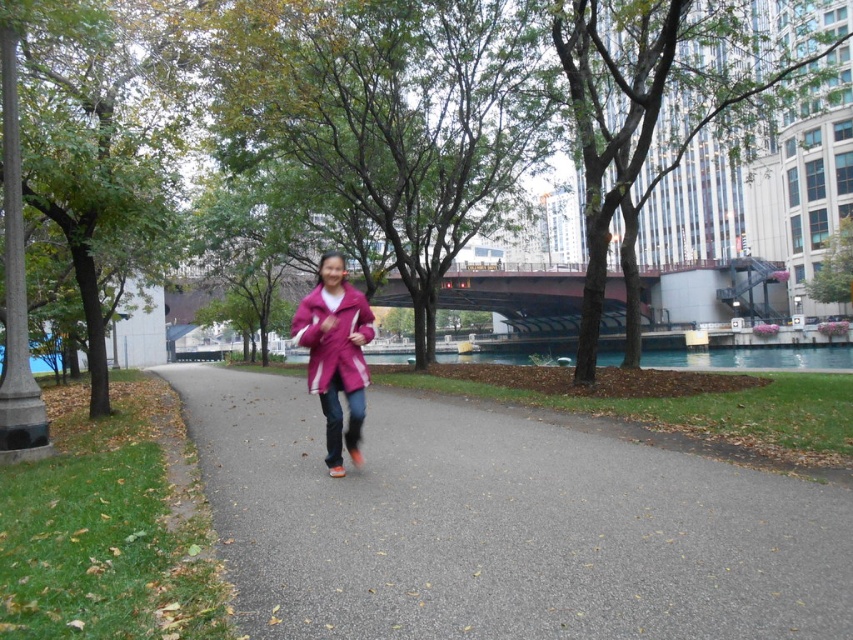
You are a photographer trying to capture the person in the pink matte jacket at center and the matte pink jacket at center. Since both jackets are pink, how can you distinguish which one is closer to you?

The pink matte jacket at center is located below the matte pink jacket at center, so the one lower in the image is closer to you.

You are a drone operator trying to capture the best aerial shot of the pink matte jacket at center. The drone is currently at coordinates point A. To ensure the jacket is centered in the frame, should you adjust the drone to move north or south? Please provide your answer based on the jacket being at point 0.555 on the x and 0.394 on the y axis.

The pink matte jacket at center is located at point 0.555 on the x and 0.394 on the y axis. Since the jacket is already at the center coordinates, no adjustment is needed. The drone should remain at point A to keep the jacket centered.